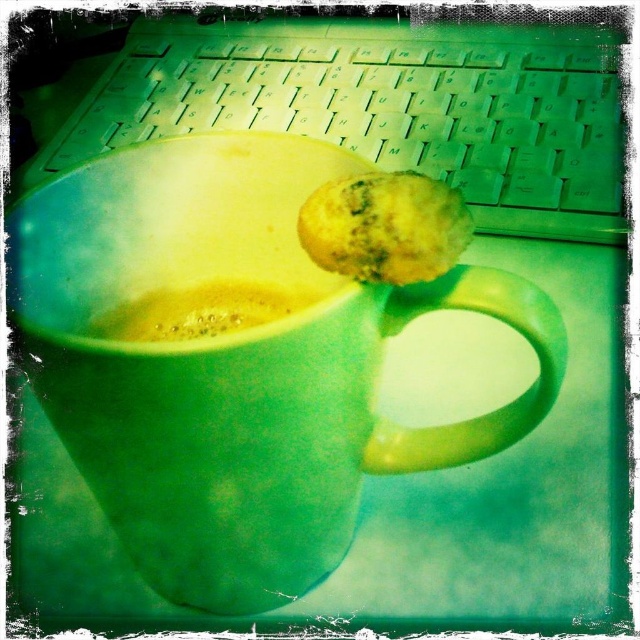
Question: Among these points, which one is nearest to the camera?

Choices:
 (A) (99, 200)
 (B) (358, 202)
 (C) (209, 288)

Answer: (B)

Question: Among these objects, which one is nearest to the camera?

Choices:
 (A) green matte mug at center
 (B) yellow frothy liquid at center
 (C) yellowish matte muffin at center

Answer: (A)

Question: Is green matte mug at center thinner than yellow frothy liquid at center?

Choices:
 (A) yes
 (B) no

Answer: (B)

Question: Does green plastic keyboard at upper center appear under yellow frothy liquid at center?

Choices:
 (A) no
 (B) yes

Answer: (A)

Question: Which object is positioned farthest from the green matte mug at center?

Choices:
 (A) yellow frothy liquid at center
 (B) yellowish matte muffin at center

Answer: (B)

Question: Does green matte mug at center appear on the right side of yellowish matte muffin at center?

Choices:
 (A) no
 (B) yes

Answer: (A)